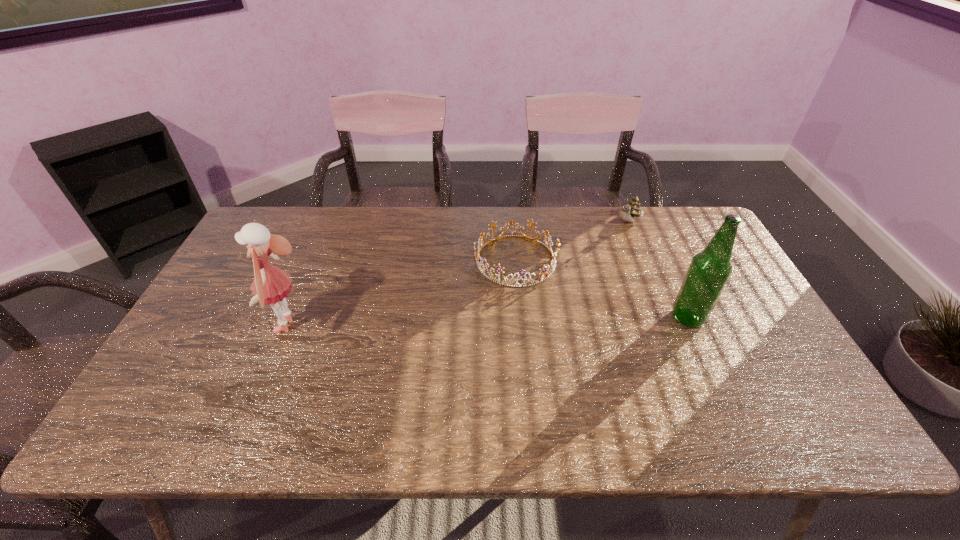
Where is `the leftmost object`? Image resolution: width=960 pixels, height=540 pixels. the leftmost object is located at coordinates (271, 285).

The height and width of the screenshot is (540, 960). In order to click on beer bottle in this screenshot , I will do `click(710, 269)`.

You are a GUI agent. You are given a task and a screenshot of the screen. Output one action in this format:
    pyautogui.click(x=<x>, y=<y>)
    Task: Click on the second object from left to right
    The image size is (960, 540).
    Given the screenshot: What is the action you would take?
    (498, 268)

You are a GUI agent. You are given a task and a screenshot of the screen. Output one action in this format:
    pyautogui.click(x=<x>, y=<y>)
    Task: Click on the tiara
    The width and height of the screenshot is (960, 540).
    Given the screenshot: What is the action you would take?
    pyautogui.click(x=498, y=268)

Identify the location of the second shortest object. This screenshot has width=960, height=540. (633, 209).

Where is `snail`? snail is located at coordinates (633, 209).

Locate an element on the screen. free region located on the front-facing side of the leftmost object is located at coordinates (200, 326).

The height and width of the screenshot is (540, 960). I want to click on vacant space situated on the front-facing side of the leftmost object, so click(249, 326).

You are a GUI agent. You are given a task and a screenshot of the screen. Output one action in this format:
    pyautogui.click(x=<x>, y=<y>)
    Task: Click on the free location located 0.160m on the front-facing side of the leftmost object
    This screenshot has height=540, width=960.
    Given the screenshot: What is the action you would take?
    pyautogui.click(x=211, y=326)

Where is `blank area located 0.050m on the label of the beer bottle`? This screenshot has width=960, height=540. blank area located 0.050m on the label of the beer bottle is located at coordinates (653, 318).